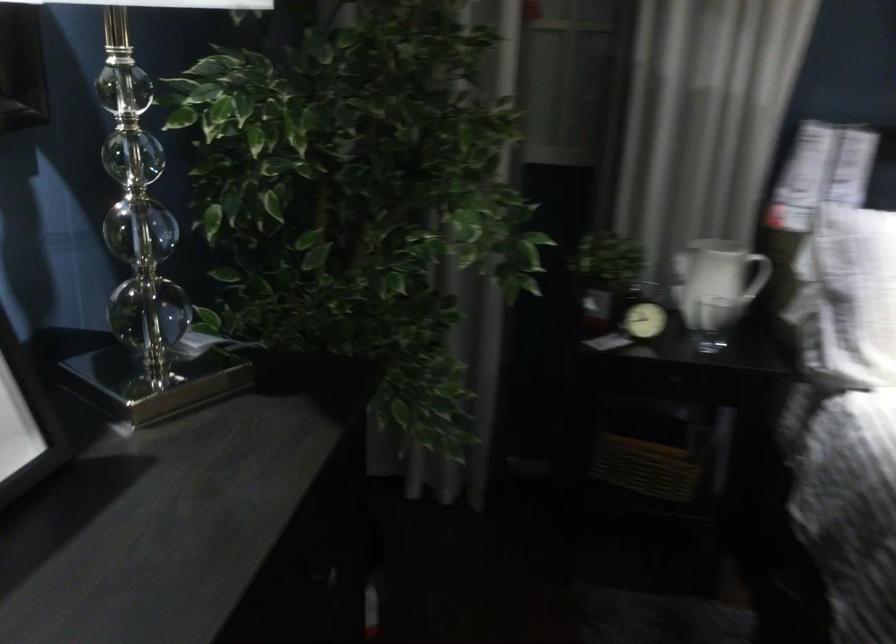
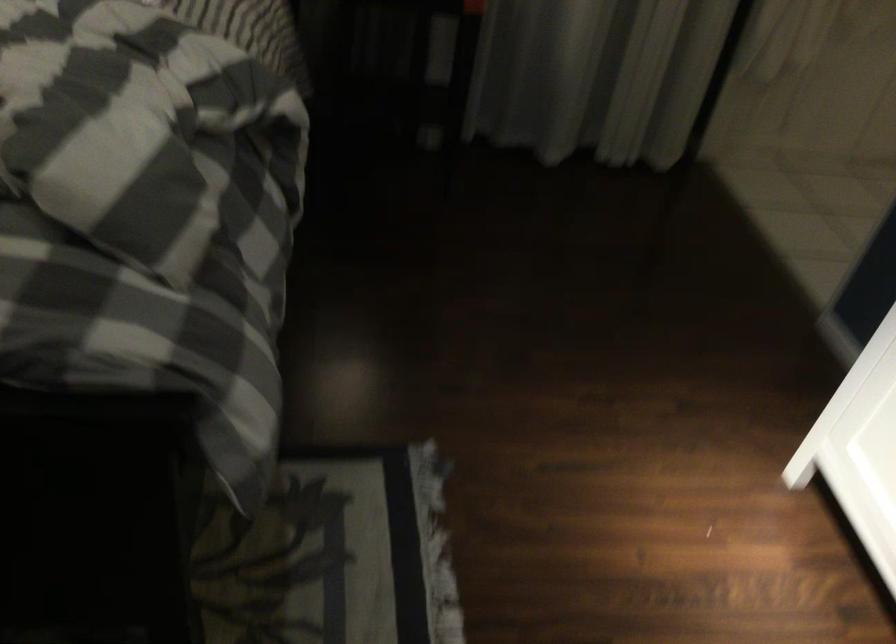
Which direction would the cameraman need to move to produce the second image?

The movement direction of the cameraman is right, backward.